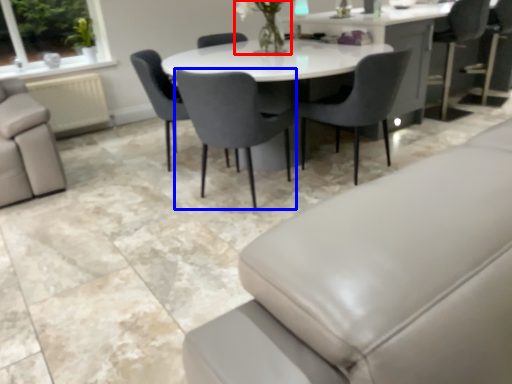
Question: Which object appears farthest to the camera in this image, floral arrangement (highlighted by a red box) or chair (highlighted by a blue box)?

Choices:
 (A) floral arrangement
 (B) chair

Answer: (A)